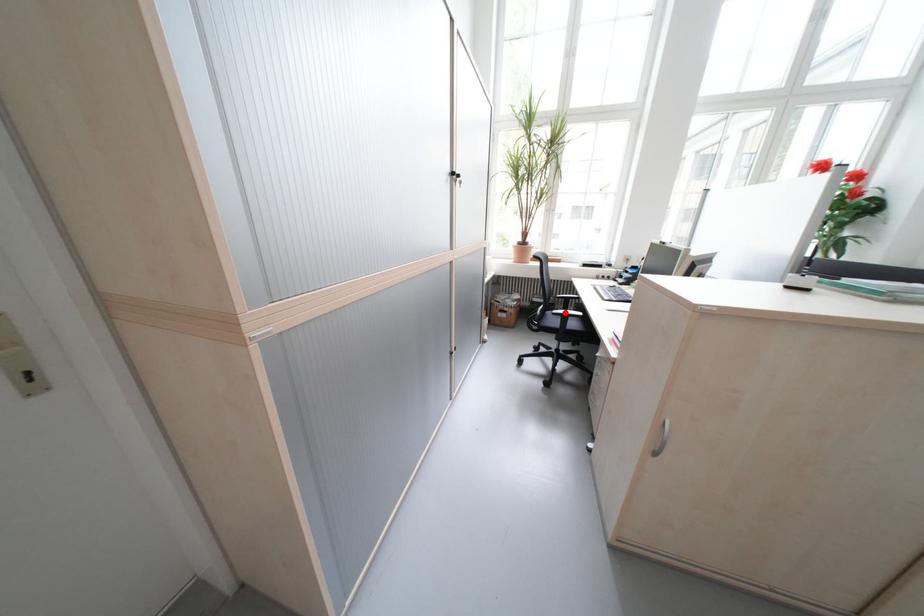
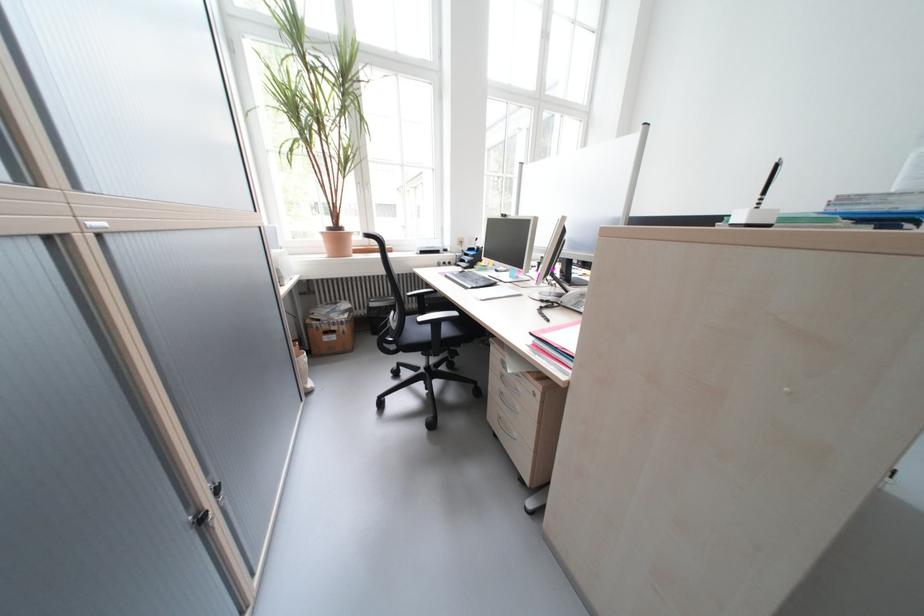
In the second image, find the point that corresponds to the highlighted location in the first image.

(431, 320)